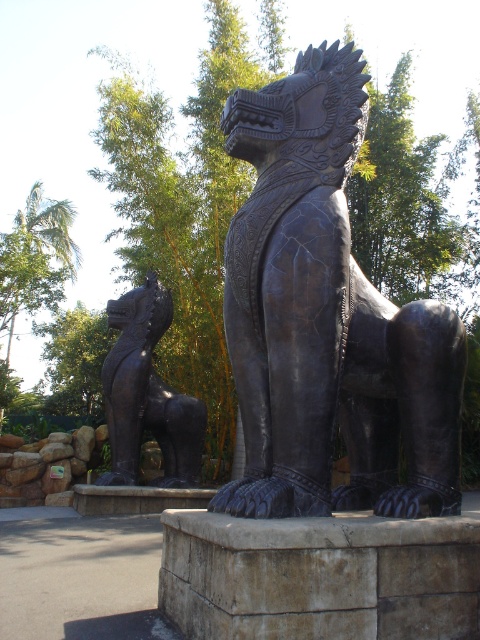
Which is above, bronze textured lion at center or bronze statue at center?

bronze textured lion at center is higher up.

Is bronze textured lion at center above bronze statue at center?

Yes.

Which is behind, point (304, 445) or point (197, 465)?

Point (197, 465)

This screenshot has width=480, height=640. Find the location of `bronze textured lion at center`. bronze textured lion at center is located at coordinates (326, 320).